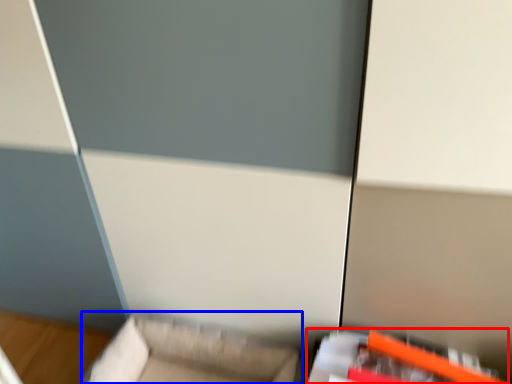
Question: Among these objects, which one is nearest to the camera, furniture (highlighted by a red box) or furniture (highlighted by a blue box)?

Choices:
 (A) furniture
 (B) furniture

Answer: (A)